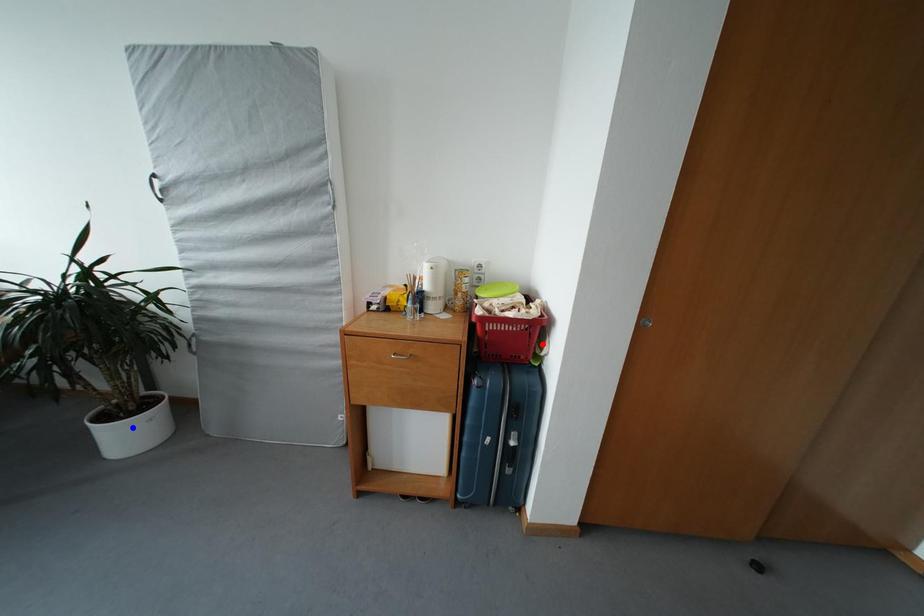
Question: Two points are marked on the image. Which point is closer to the camera?

Choices:
 (A) Blue point is closer.
 (B) Red point is closer.

Answer: (B)